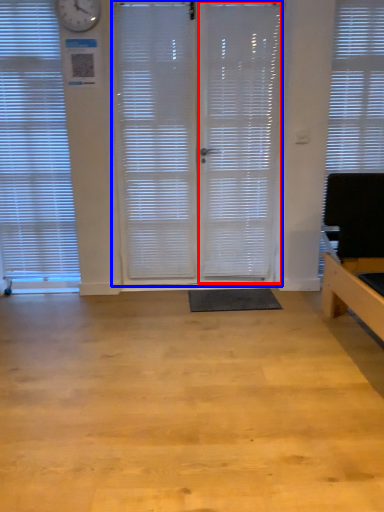
Question: Among these objects, which one is nearest to the camera, screen door (highlighted by a red box) or screen door (highlighted by a blue box)?

Choices:
 (A) screen door
 (B) screen door

Answer: (A)